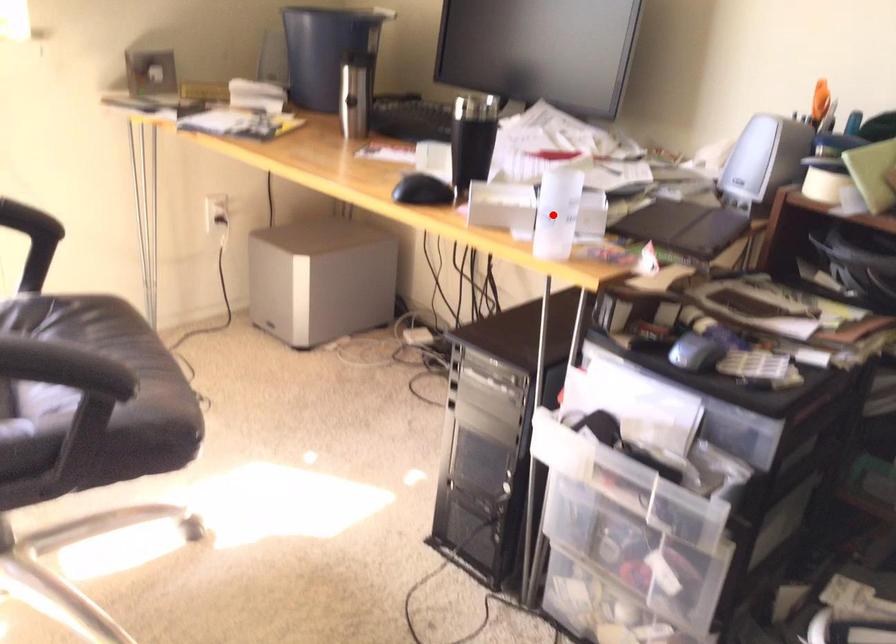
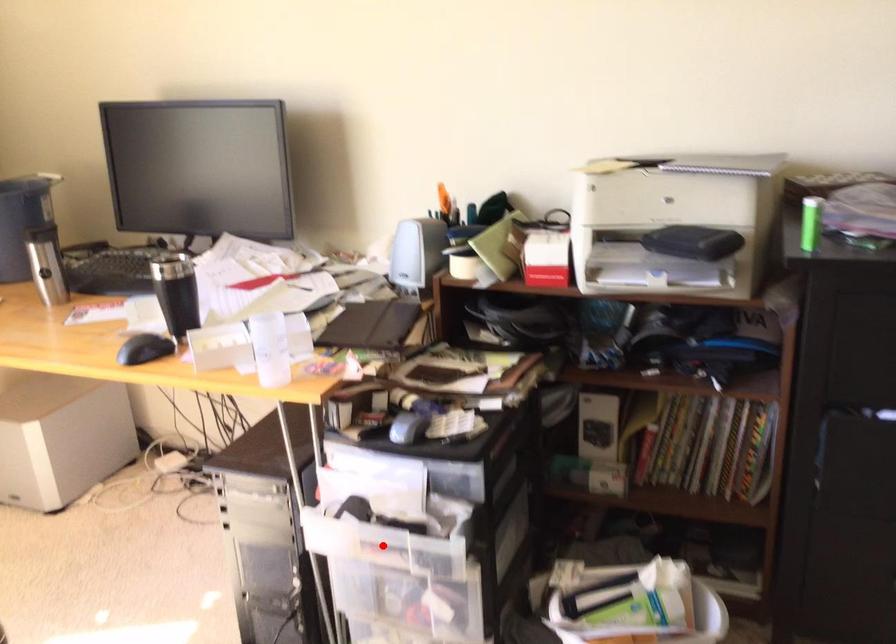
I am providing you with two images of the same scene from different viewpoints. A red point is marked on the first image and another point is marked on the second image. Do the highlighted points in image1 and image2 indicate the same real-world spot?

No